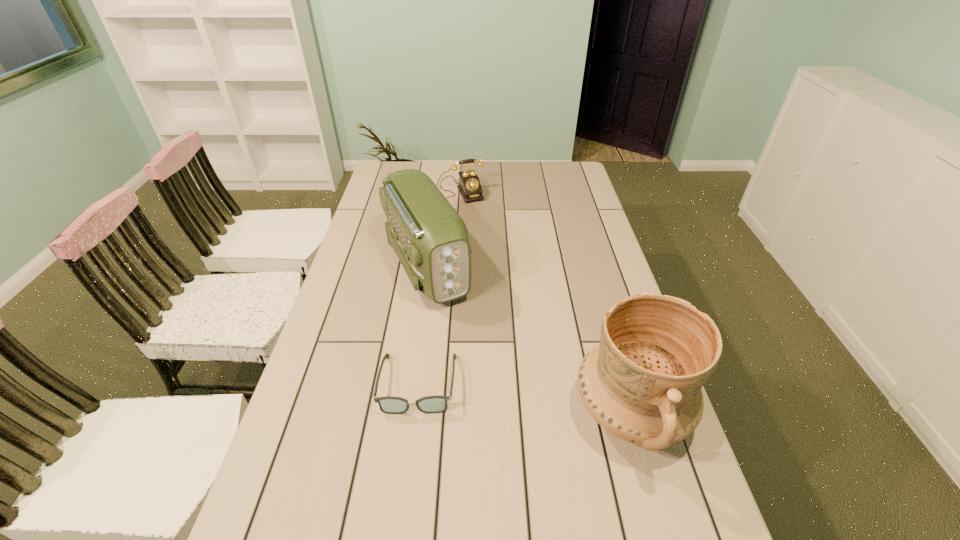
Image resolution: width=960 pixels, height=540 pixels. Find the location of `free spot on the desktop that is between the shortest object and the pottery and is positioned on the front-facing side of the second farthest object`. free spot on the desktop that is between the shortest object and the pottery and is positioned on the front-facing side of the second farthest object is located at coordinates (501, 395).

Find the location of `vacant space on the desktop that is between the shortest object and the pottery and is positioned on the dial of the second shortest object`. vacant space on the desktop that is between the shortest object and the pottery and is positioned on the dial of the second shortest object is located at coordinates (546, 400).